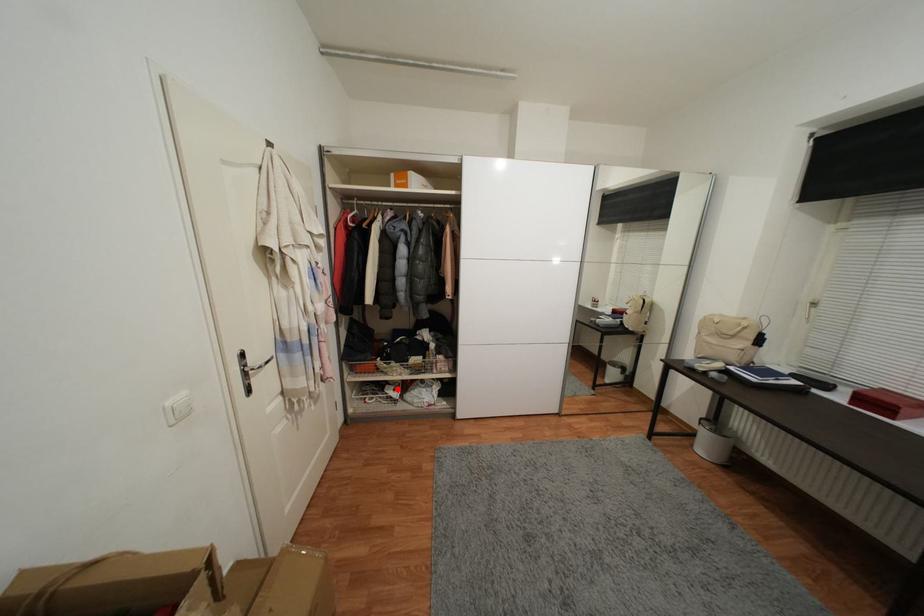
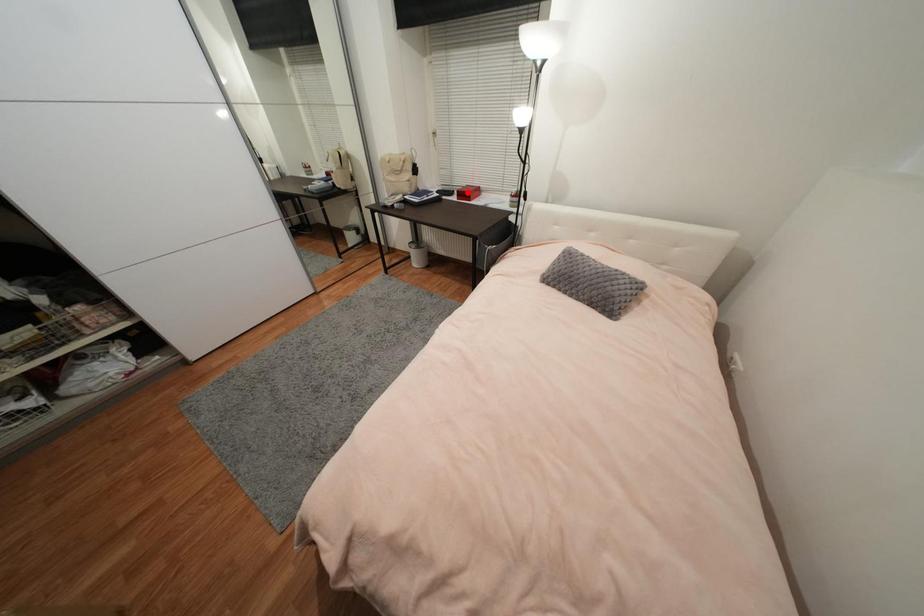
I am providing you with two images of the same scene from different viewpoints. A red point is marked on the first image and another point is marked on the second image. Does the point marked in image1 correspond to the same location as the one in image2?

No